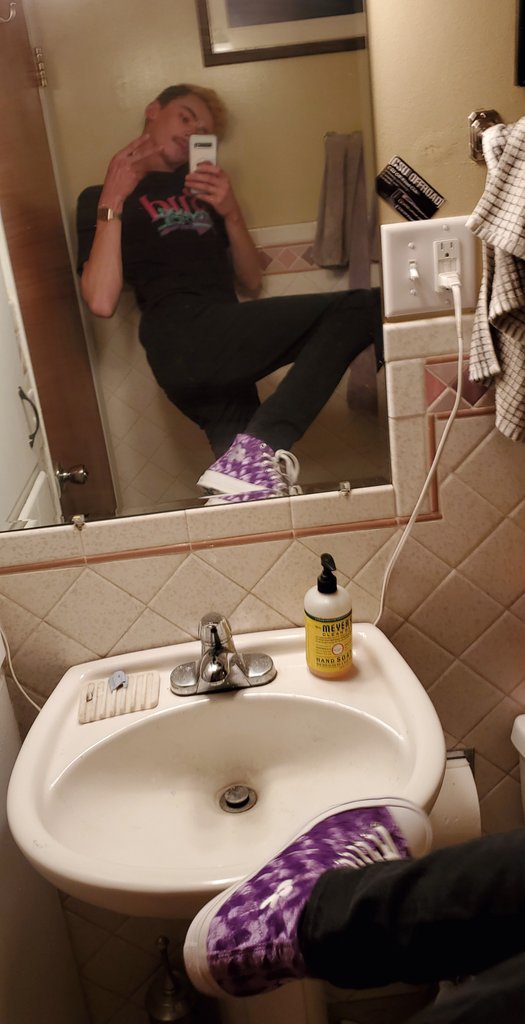
This screenshot has width=525, height=1024. Find the location of `cord`. cord is located at coordinates (425, 486).